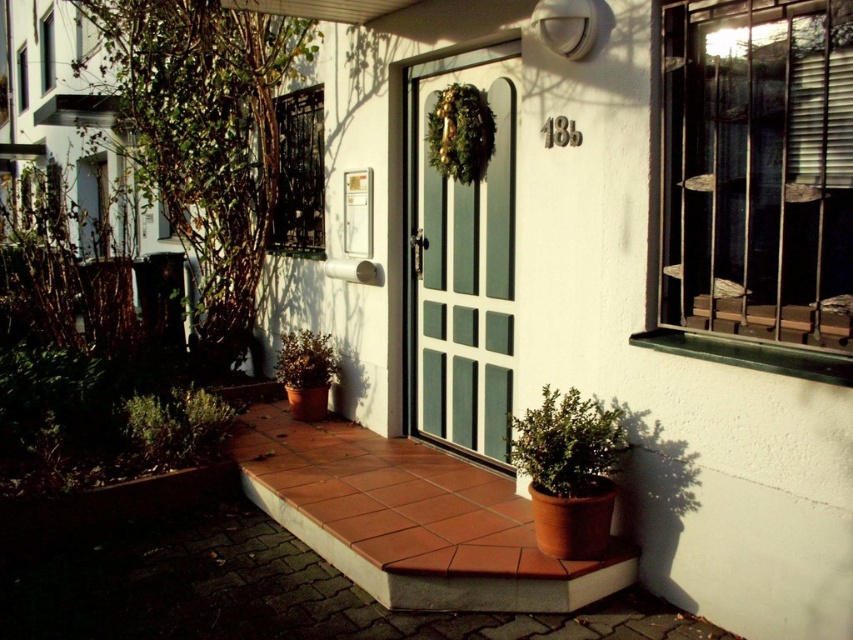
Question: Which point appears farthest from the camera in this image?

Choices:
 (A) (444, 141)
 (B) (674, 307)
 (C) (189, 388)
 (D) (302, 129)

Answer: (D)

Question: Can you confirm if green leafy plant at left is positioned above green matte plant at lower left?

Choices:
 (A) yes
 (B) no

Answer: (A)

Question: Can you confirm if green leafy plant at lower left is thinner than white painted wooden window at upper left?

Choices:
 (A) no
 (B) yes

Answer: (A)

Question: Which object appears farthest from the camera in this image?

Choices:
 (A) white painted wooden window at upper left
 (B) green matte plant at lower left
 (C) green matte door at center

Answer: (A)

Question: Is metallic wire mesh at upper left positioned at the back of green matte wreath at center?

Choices:
 (A) no
 (B) yes

Answer: (B)

Question: Which point appears closest to the camera in this image?

Choices:
 (A) (48, 35)
 (B) (476, 148)
 (C) (166, 61)

Answer: (B)